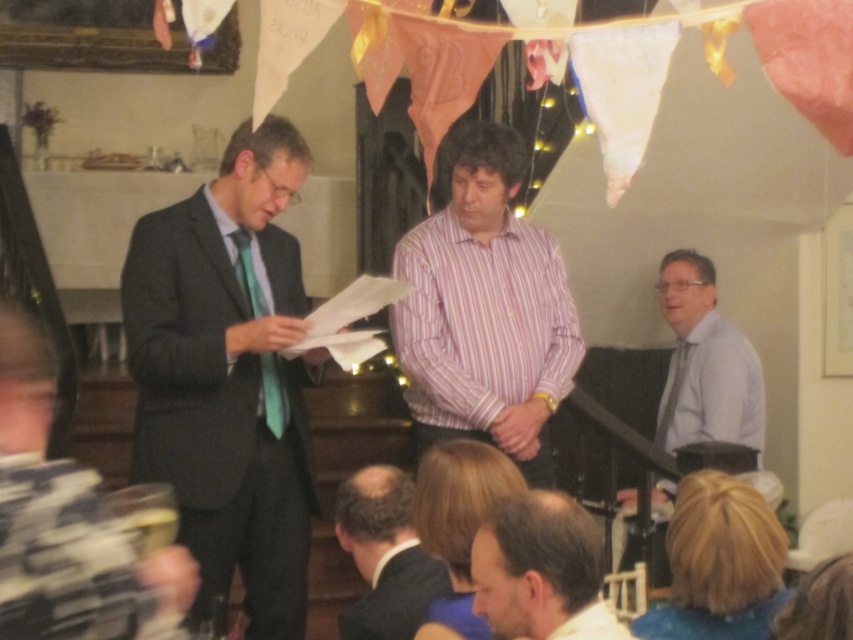
You are a photographer at the event and want to take a photo of the dark brown hair at center and the white silk tie at right. From the perspective of someone facing the scene, which object should be placed on the left side of the photo?

The dark brown hair at center should be placed on the left side of the photo because it is to the left of the white silk tie at right.